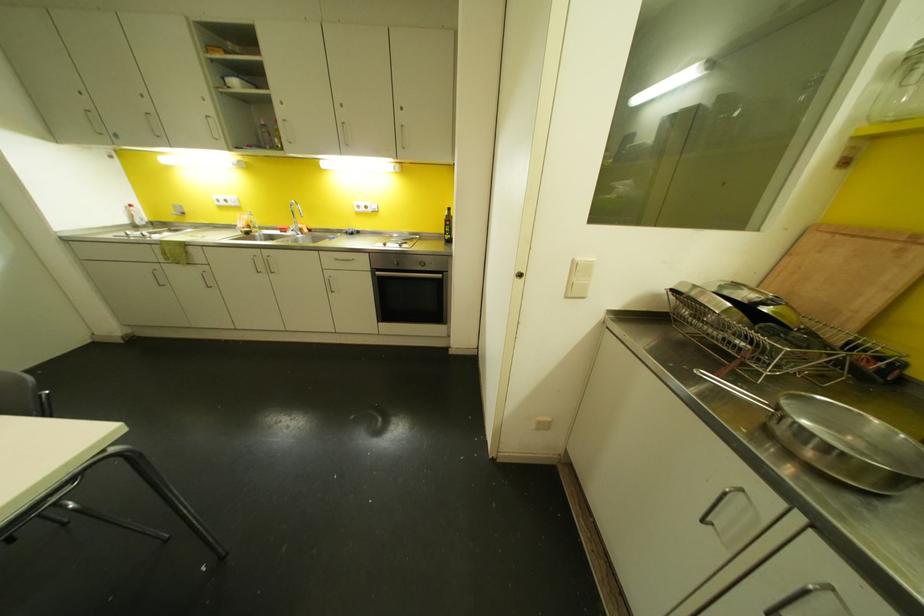
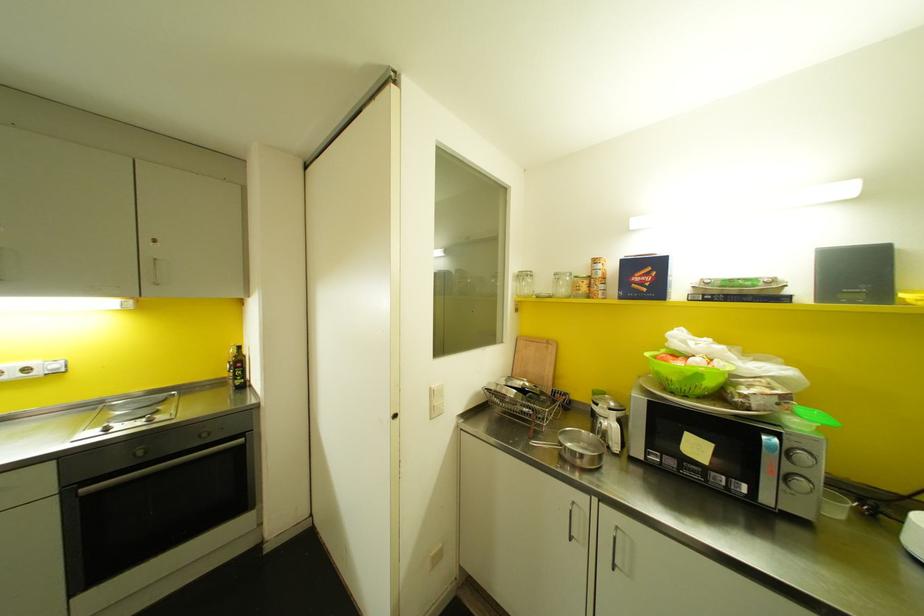
Locate, in the second image, the point that corresponds to (423,264) in the first image.

(204, 434)